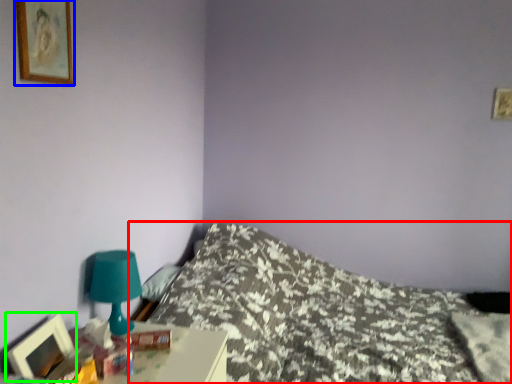
Question: Considering the real-world distances, which object is farthest from bed (highlighted by a red box)? picture frame (highlighted by a blue box) or picture frame (highlighted by a green box)?

Choices:
 (A) picture frame
 (B) picture frame

Answer: (A)